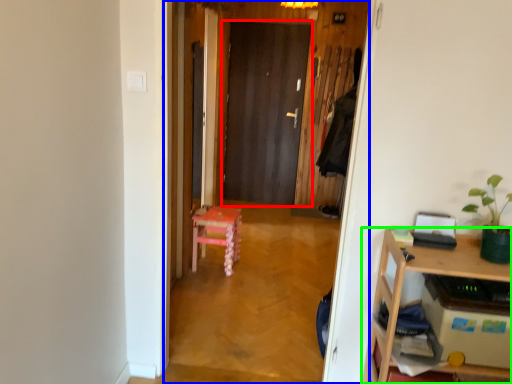
Question: Considering the real-world distances, which object is farthest from door (highlighted by a red box)? corridor (highlighted by a blue box) or desk (highlighted by a green box)?

Choices:
 (A) corridor
 (B) desk

Answer: (B)